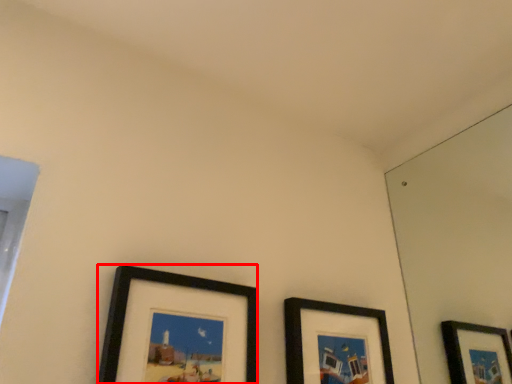
Question: In this image, where is picture frame (annotated by the red box) located relative to picture frame?

Choices:
 (A) left
 (B) right

Answer: (A)